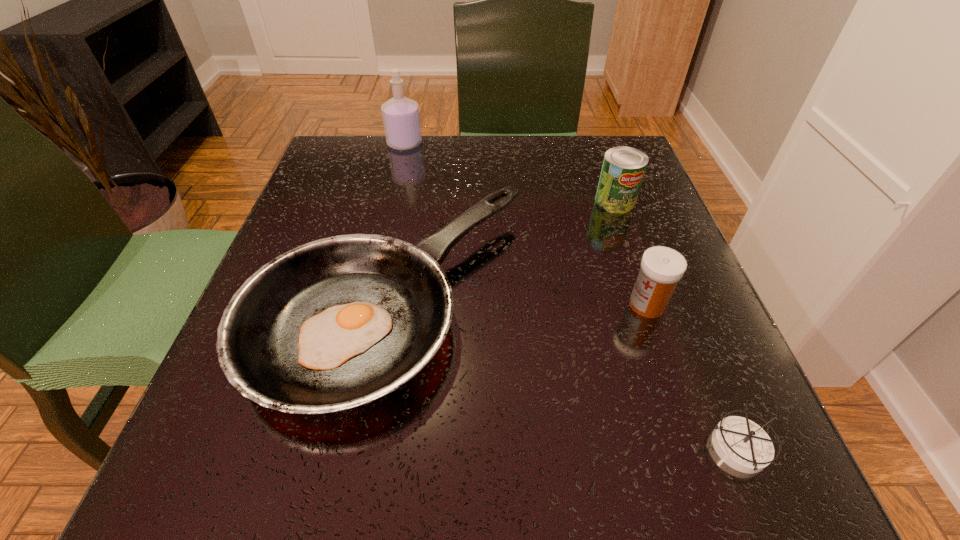
You are a GUI agent. You are given a task and a screenshot of the screen. Output one action in this format:
    pyautogui.click(x=<x>, y=<y>)
    Task: Click on the free space at the far right corner of the desktop
    
    Given the screenshot: What is the action you would take?
    pyautogui.click(x=599, y=142)

Identify the location of vacant space at the near right corner of the desktop. [709, 463].

The width and height of the screenshot is (960, 540). Identify the location of unoccupied area between the second shortest object and the perfume. (397, 221).

The width and height of the screenshot is (960, 540). In order to click on vacant area that lies between the perfume and the medicine in this screenshot , I will do `click(526, 224)`.

Locate an element on the screen. This screenshot has width=960, height=540. free spot between the medicine and the fourth tallest object is located at coordinates (518, 302).

Identify the location of free space between the medicine and the can. The width and height of the screenshot is (960, 540). (631, 253).

Where is `vacant space that is in between the medicine and the frying pan`? The width and height of the screenshot is (960, 540). vacant space that is in between the medicine and the frying pan is located at coordinates (518, 302).

Where is `vacant space that's between the can and the frying pan`? vacant space that's between the can and the frying pan is located at coordinates (502, 250).

Where is `vacant space that's between the tallest object and the compass`? vacant space that's between the tallest object and the compass is located at coordinates (573, 296).

Find the location of a particular element. This screenshot has width=960, height=540. free space between the farthest object and the can is located at coordinates (510, 172).